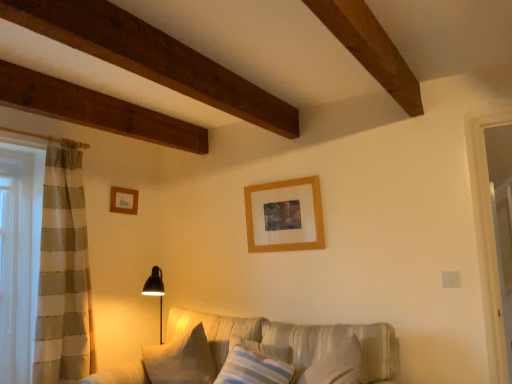
What is the approximate height of white soft pillow at lower center, placed as the first pillow when sorted from left to right?

white soft pillow at lower center, placed as the first pillow when sorted from left to right, is 19.71 inches tall.

At what (x,y) coordinates should I click in order to perform the action: click on wooden picture frame at upper left, placed as the 2th picture frame when sorted from front to back. Please return your answer as a coordinate pair (x, y). The width and height of the screenshot is (512, 384). Looking at the image, I should click on (123, 200).

Measure the distance between point (248, 357) and camera.

A distance of 2.48 meters exists between point (248, 357) and camera.

Based on the photo, how much space does striped fabric pillow at center, the second pillow in the left-to-right sequence, occupy vertically?

striped fabric pillow at center, the second pillow in the left-to-right sequence, is 11.18 inches in height.

This screenshot has width=512, height=384. Find the location of `wooden picture frame at upper center, the 1th picture frame when ordered from right to left`. wooden picture frame at upper center, the 1th picture frame when ordered from right to left is located at coordinates (284, 216).

In terms of width, does textured beige couch at center look wider or thinner when compared to striped fabric pillow at center, which is the 1th pillow in right-to-left order?

Clearly, textured beige couch at center has more width compared to striped fabric pillow at center, which is the 1th pillow in right-to-left order.

From a real-world perspective, which object stands above the other?

striped fabric pillow at center, the second pillow in the left-to-right sequence.

Is textured beige couch at center outside of striped fabric pillow at center, the second pillow in the left-to-right sequence?

Yes.

Is textured beige couch at center far from striped fabric pillow at center, which is the 1th pillow in right-to-left order?

No.

Considering the sizes of objects wooden picture frame at upper left, which ranks as the first picture frame in back-to-front order, and striped fabric pillow at center, which is the 1th pillow in right-to-left order, in the image provided, who is bigger, wooden picture frame at upper left, which ranks as the first picture frame in back-to-front order, or striped fabric pillow at center, which is the 1th pillow in right-to-left order,?

striped fabric pillow at center, which is the 1th pillow in right-to-left order, is bigger.

Choose the correct answer: Is wooden picture frame at upper left, placed as the 2th picture frame when sorted from front to back, inside striped fabric pillow at center, the second pillow in the left-to-right sequence, or outside it?

The correct answer is: outside.

From the image's perspective, who appears lower, wooden picture frame at upper left, the second picture frame when ordered from right to left, or striped fabric pillow at center, which is the 1th pillow in right-to-left order?

striped fabric pillow at center, which is the 1th pillow in right-to-left order, is shown below in the image.

Does wooden picture frame at upper center, the 2th picture frame in the left-to-right sequence, have a lesser height compared to textured beige couch at center?

Correct, wooden picture frame at upper center, the 2th picture frame in the left-to-right sequence, is not as tall as textured beige couch at center.

From a real-world perspective, between wooden picture frame at upper center, the 2th picture frame in the left-to-right sequence, and textured beige couch at center, who is vertically lower?

textured beige couch at center, from a real-world perspective.

Based on the photo, does wooden picture frame at upper center, which is counted as the first picture frame, starting from the front, have a greater width compared to textured beige couch at center?

No.

Is point (287, 180) positioned in front of point (316, 340)?

That is False.

From the image's perspective, which one is positioned higher, wooden picture frame at upper center, the 1th picture frame when ordered from right to left, or wooden picture frame at upper left, which is counted as the first picture frame, starting from the left?

wooden picture frame at upper left, which is counted as the first picture frame, starting from the left.

Considering the positions of objects wooden picture frame at upper center, the 2th picture frame in the left-to-right sequence, and wooden picture frame at upper left, which is counted as the first picture frame, starting from the left, in the image provided, who is behind, wooden picture frame at upper center, the 2th picture frame in the left-to-right sequence, or wooden picture frame at upper left, which is counted as the first picture frame, starting from the left,?

wooden picture frame at upper left, which is counted as the first picture frame, starting from the left, is further away from the camera.

How many degrees apart are the facing directions of wooden picture frame at upper center, which is the 2th picture frame in back-to-front order, and wooden picture frame at upper left, which ranks as the first picture frame in back-to-front order?

wooden picture frame at upper center, which is the 2th picture frame in back-to-front order, and wooden picture frame at upper left, which ranks as the first picture frame in back-to-front order, are facing 87.4 degrees away from each other.

Is there a large distance between striped fabric pillow at center, the second pillow in the left-to-right sequence, and wooden picture frame at upper center, the 2th picture frame in the left-to-right sequence?

No, striped fabric pillow at center, the second pillow in the left-to-right sequence, is not far from wooden picture frame at upper center, the 2th picture frame in the left-to-right sequence.

Is striped fabric pillow at center, the second pillow in the left-to-right sequence, further to the viewer compared to wooden picture frame at upper center, the 2th picture frame in the left-to-right sequence?

No, striped fabric pillow at center, the second pillow in the left-to-right sequence, is closer to the camera.

Can you confirm if striped fabric pillow at center, which is the 1th pillow in right-to-left order, is wider than wooden picture frame at upper center, which is counted as the first picture frame, starting from the front?

Yes.

Identify the location of the 2nd pillow in front of the wooden picture frame at upper center, which is the 2th picture frame in back-to-front order. (257, 364).

Does striped fabric pillow at center, the second pillow in the left-to-right sequence, appear on the right side of white soft pillow at lower center, placed as the first pillow when sorted from left to right?

Correct, you'll find striped fabric pillow at center, the second pillow in the left-to-right sequence, to the right of white soft pillow at lower center, placed as the first pillow when sorted from left to right.

From the image's perspective, is striped fabric pillow at center, which is the 1th pillow in right-to-left order, located beneath white soft pillow at lower center, which is the 2th pillow from right to left?

Actually, striped fabric pillow at center, which is the 1th pillow in right-to-left order, appears above white soft pillow at lower center, which is the 2th pillow from right to left, in the image.

From a real-world perspective, is striped fabric pillow at center, which is the 1th pillow in right-to-left order, located beneath white soft pillow at lower center, placed as the first pillow when sorted from left to right?

No, from a real-world perspective, striped fabric pillow at center, which is the 1th pillow in right-to-left order, is not below white soft pillow at lower center, placed as the first pillow when sorted from left to right.

Is wooden picture frame at upper left, which ranks as the first picture frame in back-to-front order, taller or shorter than white soft pillow at lower center, which is the 2th pillow from right to left?

Considering their sizes, wooden picture frame at upper left, which ranks as the first picture frame in back-to-front order, has less height than white soft pillow at lower center, which is the 2th pillow from right to left.

Is white soft pillow at lower center, which is the 2th pillow from right to left, inside wooden picture frame at upper left, placed as the 2th picture frame when sorted from front to back?

No, white soft pillow at lower center, which is the 2th pillow from right to left, is not a part of wooden picture frame at upper left, placed as the 2th picture frame when sorted from front to back.

Looking at this image, is there a large distance between wooden picture frame at upper left, which is counted as the first picture frame, starting from the left, and white soft pillow at lower center, which is the 2th pillow from right to left?

That's right, there is a large distance between wooden picture frame at upper left, which is counted as the first picture frame, starting from the left, and white soft pillow at lower center, which is the 2th pillow from right to left.

Considering the positions of objects wooden picture frame at upper left, the second picture frame when ordered from right to left, and white soft pillow at lower center, placed as the first pillow when sorted from left to right, in the image provided, who is more to the right, wooden picture frame at upper left, the second picture frame when ordered from right to left, or white soft pillow at lower center, placed as the first pillow when sorted from left to right,?

white soft pillow at lower center, placed as the first pillow when sorted from left to right.

Identify the location of studio couch in front of the striped fabric pillow at center, the second pillow in the left-to-right sequence. (293, 339).

Where is `the 2nd pillow to the right of the wooden picture frame at upper left, which is counted as the first picture frame, starting from the left, counting from the anchor's position`? This screenshot has height=384, width=512. the 2nd pillow to the right of the wooden picture frame at upper left, which is counted as the first picture frame, starting from the left, counting from the anchor's position is located at coordinates (257, 364).

Based on their spatial positions, is striped fabric pillow at center, the second pillow in the left-to-right sequence, or textured beige couch at center further from white soft pillow at lower center, which is the 2th pillow from right to left?

Based on the image, striped fabric pillow at center, the second pillow in the left-to-right sequence, appears to be further to white soft pillow at lower center, which is the 2th pillow from right to left.

From the image, which object appears to be nearer to white soft pillow at lower center, which is the 2th pillow from right to left, striped fabric pillow at center, the second pillow in the left-to-right sequence, or wooden picture frame at upper left, which ranks as the first picture frame in back-to-front order?

The object closer to white soft pillow at lower center, which is the 2th pillow from right to left, is striped fabric pillow at center, the second pillow in the left-to-right sequence.

Which object lies nearer to the anchor point wooden picture frame at upper center, which is counted as the first picture frame, starting from the front, white soft pillow at lower center, placed as the first pillow when sorted from left to right, or wooden picture frame at upper left, which is counted as the first picture frame, starting from the left?

white soft pillow at lower center, placed as the first pillow when sorted from left to right.

Looking at the image, which one is located further to textured beige couch at center, wooden picture frame at upper center, the 2th picture frame in the left-to-right sequence, or wooden picture frame at upper left, which is counted as the first picture frame, starting from the left?

Among the two, wooden picture frame at upper left, which is counted as the first picture frame, starting from the left, is located further to textured beige couch at center.

Estimate the real-world distances between objects in this image. Which object is further from textured beige couch at center, striped fabric pillow at center, the second pillow in the left-to-right sequence, or wooden picture frame at upper center, which is counted as the first picture frame, starting from the front?

wooden picture frame at upper center, which is counted as the first picture frame, starting from the front.

When comparing their distances from wooden picture frame at upper left, which is counted as the first picture frame, starting from the left, does white soft pillow at lower center, placed as the first pillow when sorted from left to right, or textured beige couch at center seem further?

The object further to wooden picture frame at upper left, which is counted as the first picture frame, starting from the left, is textured beige couch at center.

Considering their positions, is striped fabric pillow at center, the second pillow in the left-to-right sequence, positioned further to wooden picture frame at upper left, which is counted as the first picture frame, starting from the left, than textured beige couch at center?

striped fabric pillow at center, the second pillow in the left-to-right sequence.

When comparing their distances from wooden picture frame at upper center, the 1th picture frame when ordered from right to left, does textured beige couch at center or striped fabric pillow at center, the second pillow in the left-to-right sequence, seem closer?

Among the two, textured beige couch at center is located nearer to wooden picture frame at upper center, the 1th picture frame when ordered from right to left.

Where is `picture frame between textured beige couch at center and wooden picture frame at upper left, which ranks as the first picture frame in back-to-front order, from front to back`? This screenshot has height=384, width=512. picture frame between textured beige couch at center and wooden picture frame at upper left, which ranks as the first picture frame in back-to-front order, from front to back is located at coordinates (284, 216).

The image size is (512, 384). I want to click on pillow between wooden picture frame at upper center, which is counted as the first picture frame, starting from the front, and white soft pillow at lower center, which is the 2th pillow from right to left, vertically, so click(x=257, y=364).

Find the location of a particular element. pillow between wooden picture frame at upper left, the second picture frame when ordered from right to left, and white soft pillow at lower center, placed as the first pillow when sorted from left to right, vertically is located at coordinates (257, 364).

Identify the location of pillow located between textured beige couch at center and white soft pillow at lower center, placed as the first pillow when sorted from left to right, in the depth direction. (257, 364).